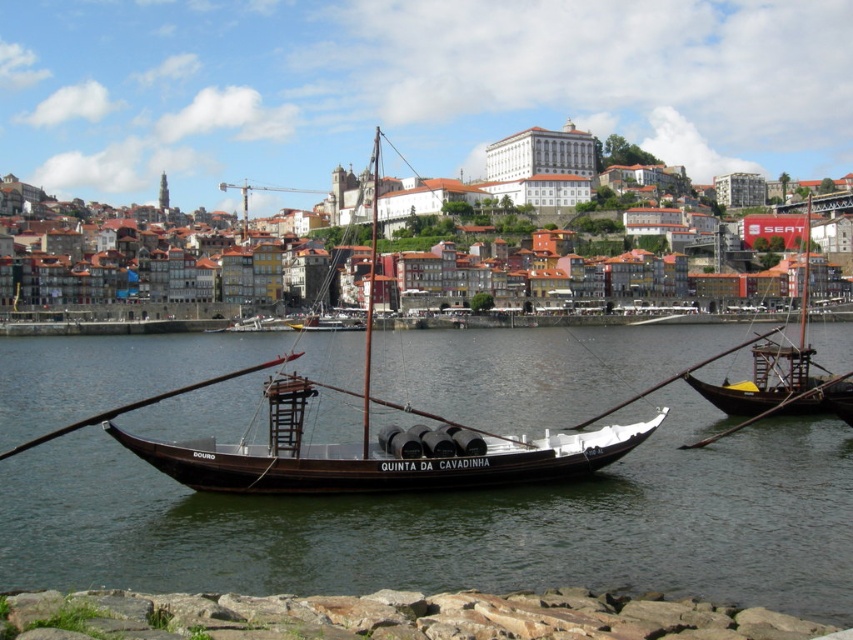
Can you confirm if brown wooden water at center is positioned to the right of wooden sailboat at right?

In fact, brown wooden water at center is to the left of wooden sailboat at right.

Between brown wooden water at center and wooden sailboat at right, which one has more height?

Standing taller between the two is wooden sailboat at right.

Between point (51, 529) and point (810, 348), which one is positioned in front?

Positioned in front is point (51, 529).

The width and height of the screenshot is (853, 640). What are the coordinates of `brown wooden water at center` in the screenshot? It's located at (463, 524).

Looking at this image, is wooden sailboat at center further to the viewer compared to wooden sailboat at right?

No, it is in front of wooden sailboat at right.

Locate an element on the screen. wooden sailboat at center is located at coordinates [x=379, y=444].

Is point (263, 476) closer to camera compared to point (796, 401)?

Yes, point (263, 476) is closer to viewer.

Image resolution: width=853 pixels, height=640 pixels. I want to click on wooden sailboat at center, so click(x=379, y=444).

Measure the distance between brown wooden water at center and wooden sailboat at center.

brown wooden water at center and wooden sailboat at center are 15.58 meters apart.

Which is above, brown wooden water at center or wooden sailboat at center?

wooden sailboat at center

Is point (344, 552) positioned before point (267, 451)?

Yes, it is in front of point (267, 451).

Identify the location of brown wooden water at center. (463, 524).